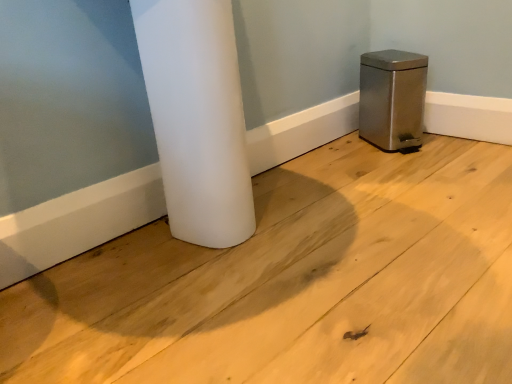
Identify the location of vacant space situated on the left part of brushed metal trash can at right. (342, 147).